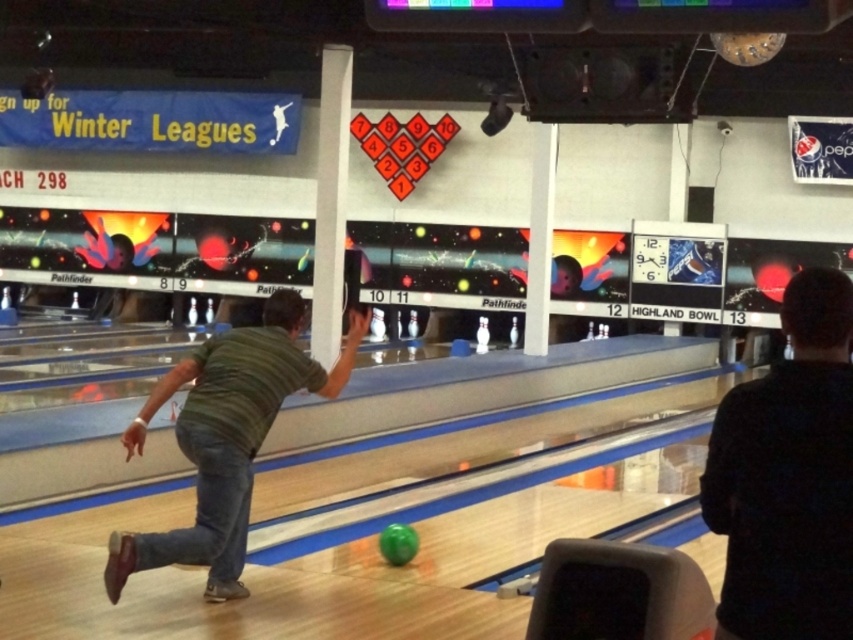
Which is more to the right, dark green shirt at center or green striped shirt at center?

Positioned to the right is dark green shirt at center.

Does dark green shirt at center lie behind green striped shirt at center?

No, dark green shirt at center is in front of green striped shirt at center.

Is point (848, 404) more distant than point (216, 476)?

No, it is not.

I want to click on dark green shirt at center, so click(788, 477).